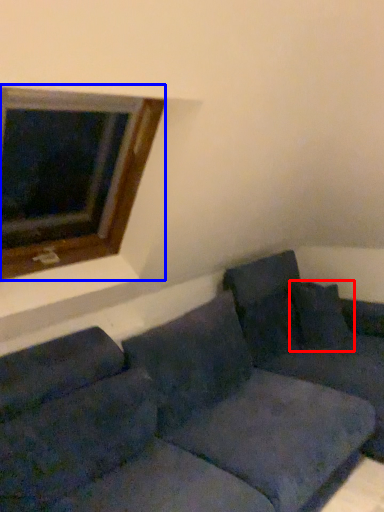
Question: Among these objects, which one is farthest to the camera, pillow (highlighted by a red box) or window (highlighted by a blue box)?

Choices:
 (A) pillow
 (B) window

Answer: (A)